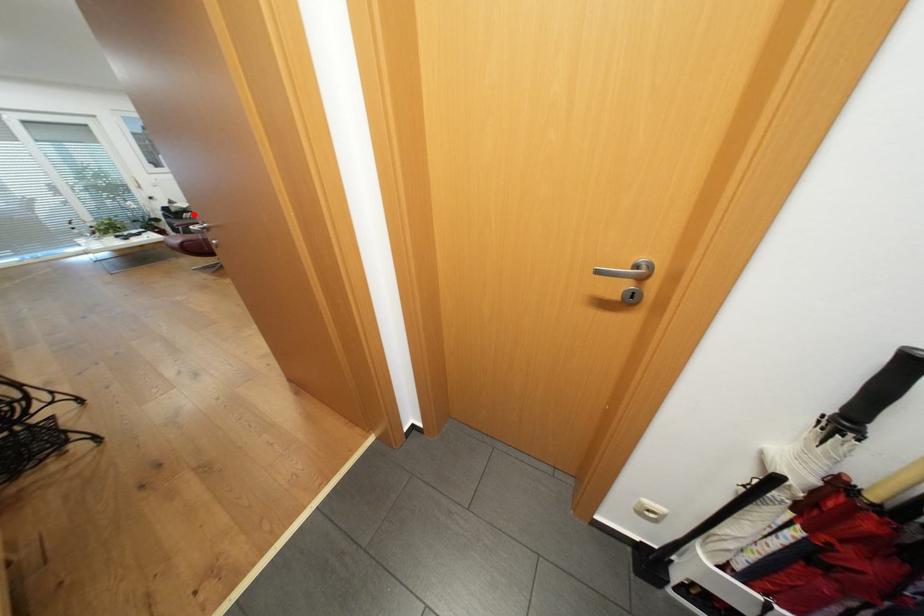
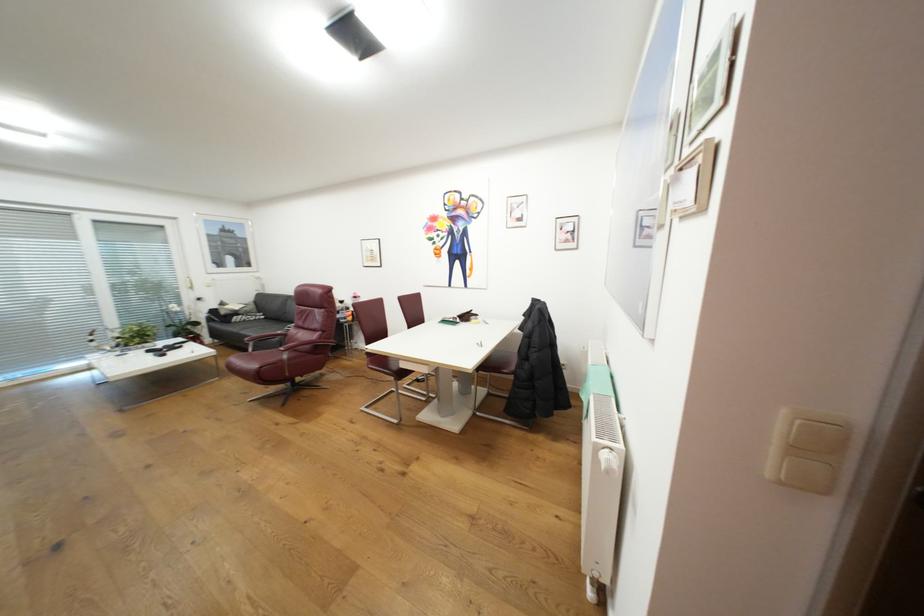
Question: I am providing you with two images of the same scene from different viewpoints. A red point is shown in image1. For the corresponding object point in image2, is it positioned nearer or farther from the camera?

Choices:
 (A) Nearer
 (B) Farther

Answer: (B)